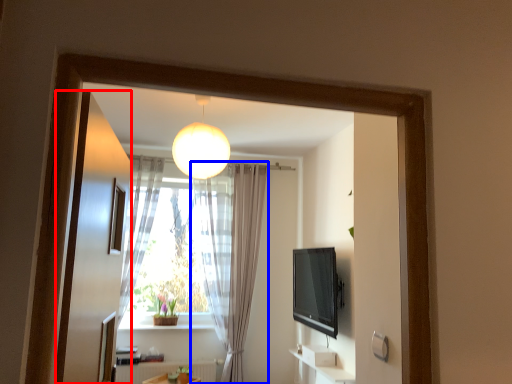
Question: Which object is closer to the camera taking this photo, screen door (highlighted by a red box) or curtain (highlighted by a blue box)?

Choices:
 (A) screen door
 (B) curtain

Answer: (A)